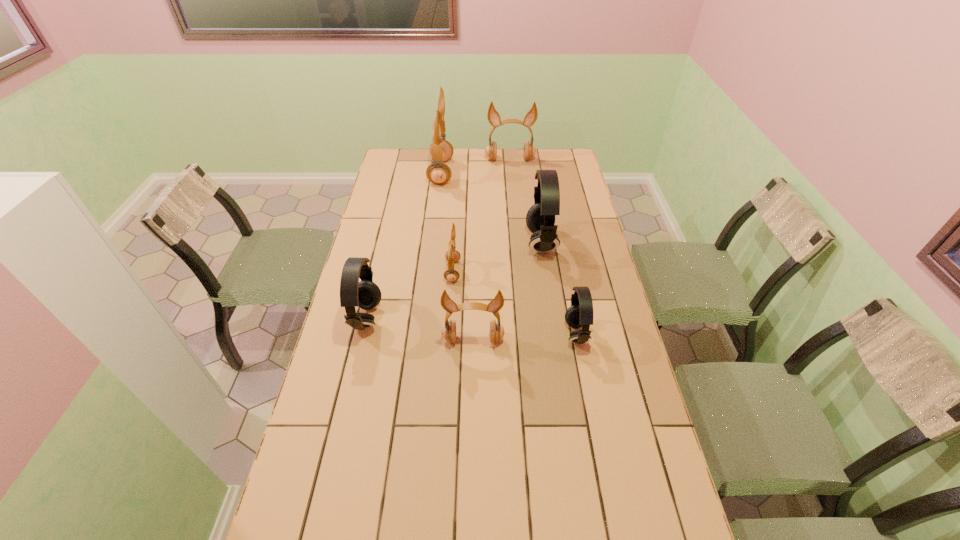
The height and width of the screenshot is (540, 960). I want to click on vacant space located 0.340m on the front-facing side of the third smallest brown earphone, so click(515, 207).

Identify the location of vacant space located 0.120m on the ear cups of the biggest black earphone. (495, 242).

The image size is (960, 540). I want to click on vacant space located 0.060m on the ear cups of the biggest black earphone, so click(511, 242).

Locate an element on the screen. This screenshot has height=540, width=960. free location located 0.110m on the ear cups of the biggest black earphone is located at coordinates (497, 242).

Identify the location of blank space located on the front-facing side of the second smallest brown earphone. (471, 460).

In order to click on free space located on the ear cups of the second smallest black earphone in this screenshot , I will do `click(502, 319)`.

Find the location of a particular element. This screenshot has width=960, height=540. vacant space located 0.180m on the front-facing side of the smallest brown earphone is located at coordinates (510, 271).

Locate an element on the screen. free space located 0.330m on the ear cups of the smallest black earphone is located at coordinates (462, 334).

You are a GUI agent. You are given a task and a screenshot of the screen. Output one action in this format:
    pyautogui.click(x=<x>, y=<y>)
    Task: Click on the free space located 0.050m on the ear cups of the smallest black earphone
    This screenshot has height=540, width=960.
    Given the screenshot: What is the action you would take?
    pyautogui.click(x=549, y=334)

You are a GUI agent. You are given a task and a screenshot of the screen. Output one action in this format:
    pyautogui.click(x=<x>, y=<y>)
    Task: Click on the free space located on the ear cups of the smallest black earphone
    The image size is (960, 540).
    Given the screenshot: What is the action you would take?
    click(502, 334)